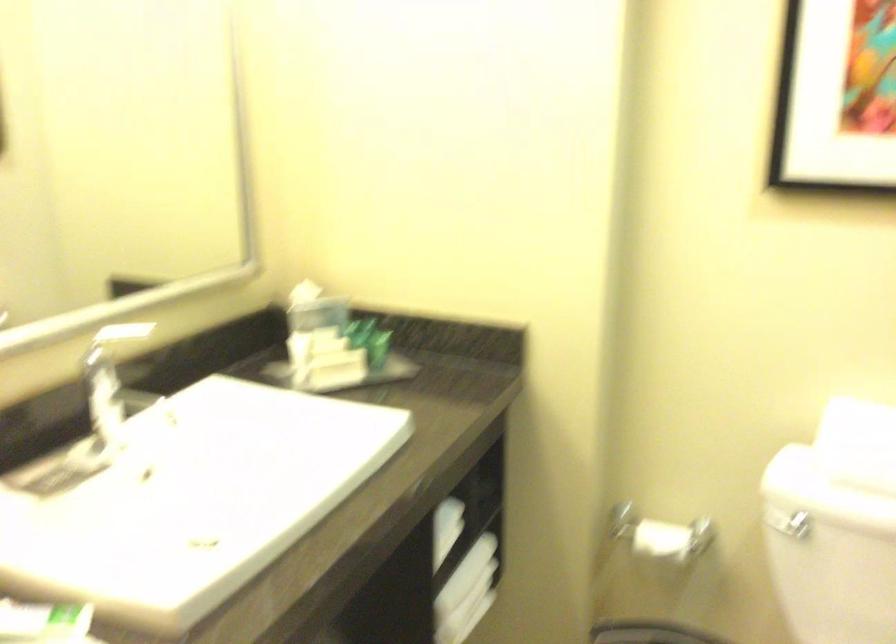
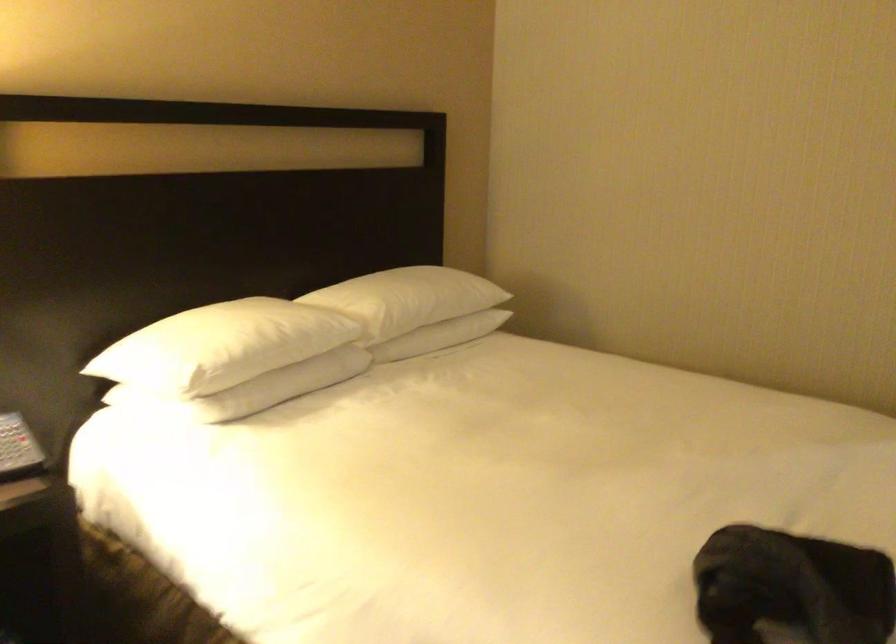
Question: I am providing you with two images of the same scene from different viewpoints. Which of the following objects are not visible in image2?

Choices:
 (A) telephone handset
 (B) white pillow
 (C) folded white towel
 (D) yellow stuffed toy

Answer: (C)